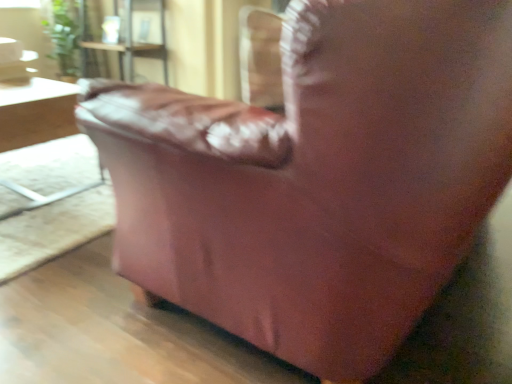
Question: From a real-world perspective, is light brown wooden table at left physically above green leafy plant at upper left?

Choices:
 (A) yes
 (B) no

Answer: (B)

Question: Is light brown wooden table at left behind green leafy plant at upper left?

Choices:
 (A) no
 (B) yes

Answer: (A)

Question: From the image's perspective, is light brown wooden table at left located above green leafy plant at upper left?

Choices:
 (A) no
 (B) yes

Answer: (A)

Question: Does light brown wooden table at left contain green leafy plant at upper left?

Choices:
 (A) no
 (B) yes

Answer: (A)

Question: Is light brown wooden table at left with green leafy plant at upper left?

Choices:
 (A) no
 (B) yes

Answer: (A)

Question: Can you confirm if light brown wooden table at left is positioned to the right of green leafy plant at upper left?

Choices:
 (A) yes
 (B) no

Answer: (A)

Question: From the image's perspective, is green leafy plant at upper left on top of light brown wooden table at left?

Choices:
 (A) yes
 (B) no

Answer: (A)

Question: Is green leafy plant at upper left bigger than light brown wooden table at left?

Choices:
 (A) yes
 (B) no

Answer: (B)

Question: Does green leafy plant at upper left come behind light brown wooden table at left?

Choices:
 (A) yes
 (B) no

Answer: (A)

Question: Is green leafy plant at upper left facing away from light brown wooden table at left?

Choices:
 (A) yes
 (B) no

Answer: (B)

Question: Is green leafy plant at upper left positioned in front of light brown wooden table at left?

Choices:
 (A) no
 (B) yes

Answer: (A)

Question: Can you confirm if green leafy plant at upper left is shorter than light brown wooden table at left?

Choices:
 (A) no
 (B) yes

Answer: (A)

Question: From the image's perspective, relative to green leafy plant at upper left, is light brown wooden table at left above or below?

Choices:
 (A) below
 (B) above

Answer: (A)